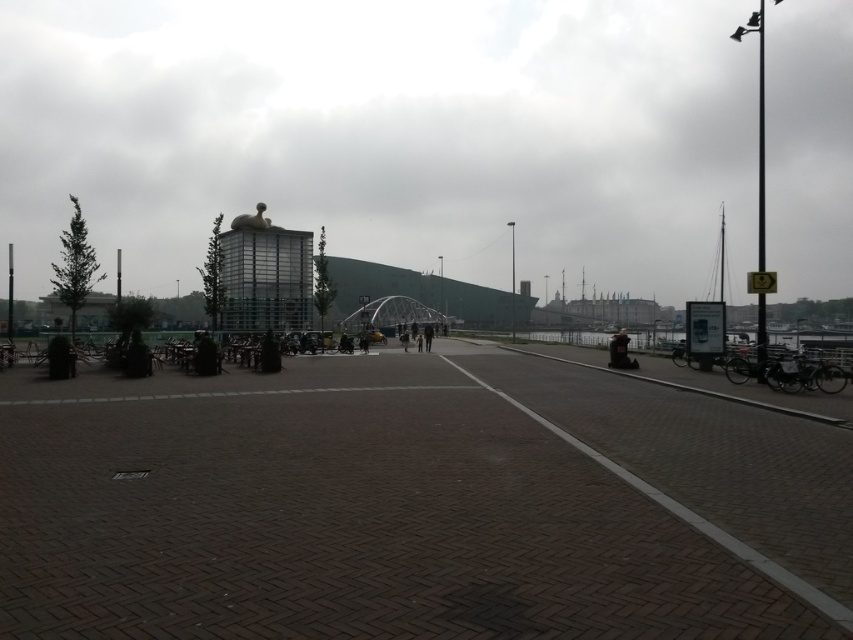
Question: Does transparent glass building at center have a lesser width compared to dark gray stone statue at lower right?

Choices:
 (A) yes
 (B) no

Answer: (B)

Question: Is transparent glass building at center positioned behind dark gray jacket at center?

Choices:
 (A) yes
 (B) no

Answer: (B)

Question: In this image, where is transparent glass building at center located relative to dark gray stone statue at lower right?

Choices:
 (A) left
 (B) right

Answer: (A)

Question: Based on their relative distances, which object is nearer to the transparent glass building at center?

Choices:
 (A) dark gray jacket at center
 (B) brown brick plaza at center

Answer: (B)

Question: Which point is closer to the camera taking this photo?

Choices:
 (A) (625, 355)
 (B) (131, 595)
 (C) (704, 125)

Answer: (B)

Question: Among these points, which one is nearest to the camera?

Choices:
 (A) (434, 28)
 (B) (398, 634)

Answer: (B)